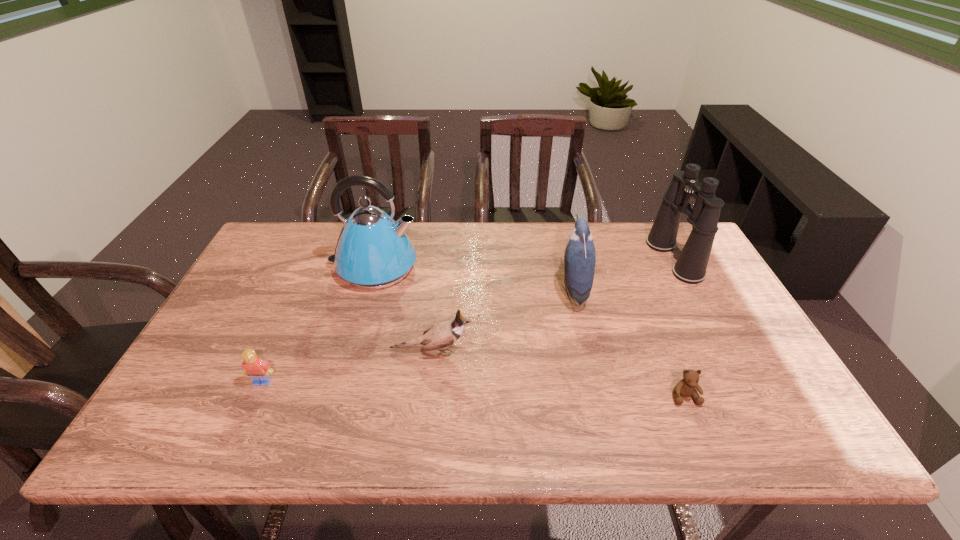
Find the location of a particular element. This screenshot has width=960, height=540. free space between the shortest object and the kettle is located at coordinates (529, 332).

Where is `vacant area between the farther bird and the Lego`? The height and width of the screenshot is (540, 960). vacant area between the farther bird and the Lego is located at coordinates click(418, 336).

The height and width of the screenshot is (540, 960). Find the location of `free space between the binoculars and the fourth object from left to right`. free space between the binoculars and the fourth object from left to right is located at coordinates (623, 274).

You are a GUI agent. You are given a task and a screenshot of the screen. Output one action in this format:
    pyautogui.click(x=<x>, y=<y>)
    Task: Click on the empty location between the Lego and the shortest object
    The image size is (960, 540).
    Given the screenshot: What is the action you would take?
    pyautogui.click(x=473, y=389)

Where is `vacant point located between the shortest object and the kettle`? This screenshot has height=540, width=960. vacant point located between the shortest object and the kettle is located at coordinates (529, 332).

This screenshot has width=960, height=540. What are the coordinates of `free space between the binoculars and the shortest object` in the screenshot? It's located at (679, 327).

Identify the location of vacant area that lies between the left bird and the Lego. Image resolution: width=960 pixels, height=540 pixels. (348, 366).

You are a GUI agent. You are given a task and a screenshot of the screen. Output one action in this format:
    pyautogui.click(x=<x>, y=<y>)
    Task: Click on the free area in between the shortest object and the right bird
    
    Given the screenshot: What is the action you would take?
    pyautogui.click(x=629, y=342)

Where is `the second closest object relative to the kettle`? This screenshot has width=960, height=540. the second closest object relative to the kettle is located at coordinates pyautogui.click(x=259, y=370).

I want to click on object that stands as the fourth closest to the second shortest object, so click(686, 387).